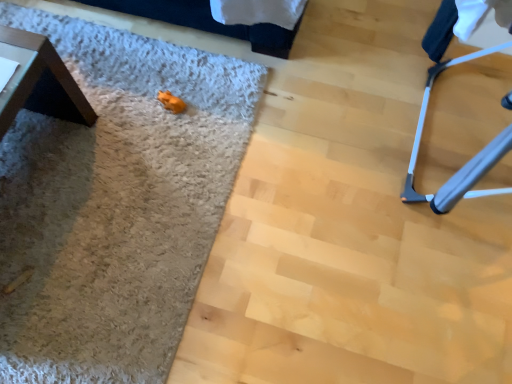
You are a GUI agent. You are given a task and a screenshot of the screen. Output one action in this format:
    pyautogui.click(x=<x>, y=<y>)
    Task: Click on the spots to the right of white shaggy rug at lower left
    This screenshot has height=384, width=512.
    Given the screenshot: What is the action you would take?
    pyautogui.click(x=345, y=200)